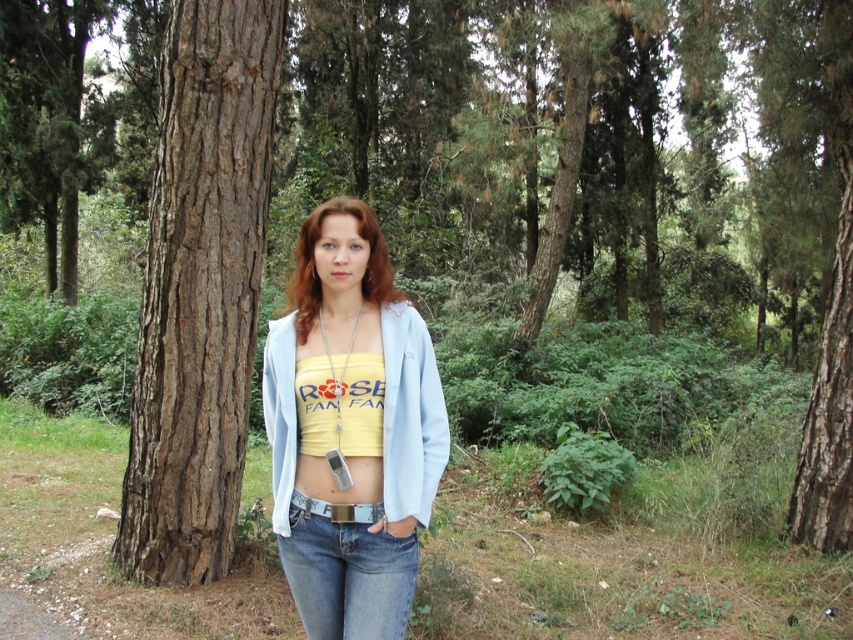
From the picture: You are a photographer trying to capture the yellow fabric top at center and the brown rough bark tree at left in the same frame. Can you see both objects clearly in the photo?

The yellow fabric top at center is behind the brown rough bark tree at left, so it will be partially or fully obscured in the photo.